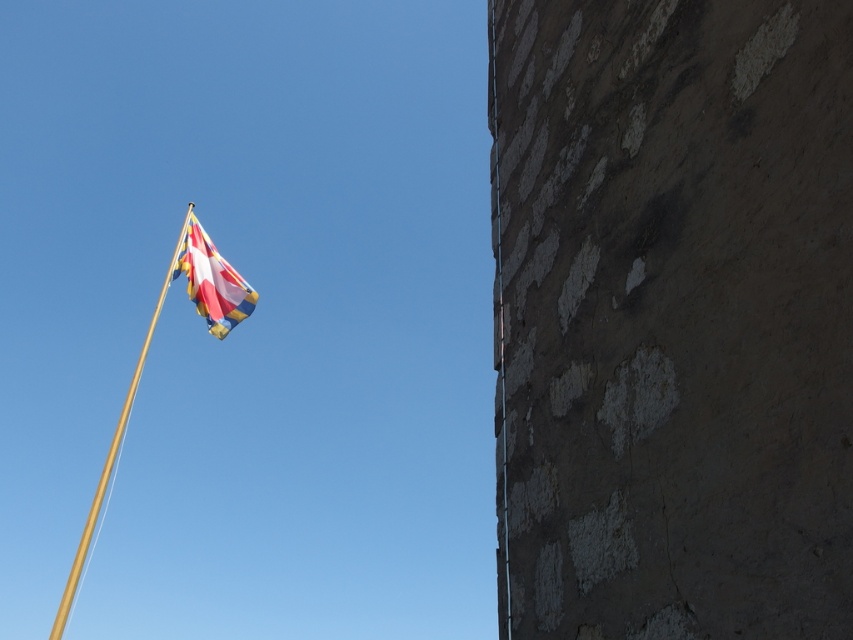
You are standing in front of the flagpole with the colorful flag waving against a clear blue sky. The flag has red, yellow, white, and blue stripes with a cross and geometric shapes. To your right, there is a stone textured wall with peeling patches of white material. Where is the stone textured wall at right located in the image?

The stone textured wall at right is located at the coordinates point (x=672, y=317) in the image.

Consider the image. You are standing at the bottom left corner of the image. You want to walk to the point marked as point [194,272]. However, there is an obstacle at point [805,138]. Will you encounter this obstacle before reaching your destination?

Yes, you will encounter the obstacle at point [805,138] before reaching point [194,272] because point [805,138] is in front of point [194,272].